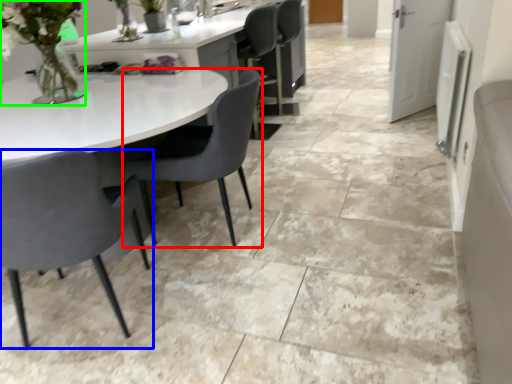
Question: Considering the real-world distances, which object is closest to chair (highlighted by a red box)? chair (highlighted by a blue box) or floral arrangement (highlighted by a green box).

Choices:
 (A) chair
 (B) floral arrangement

Answer: (A)